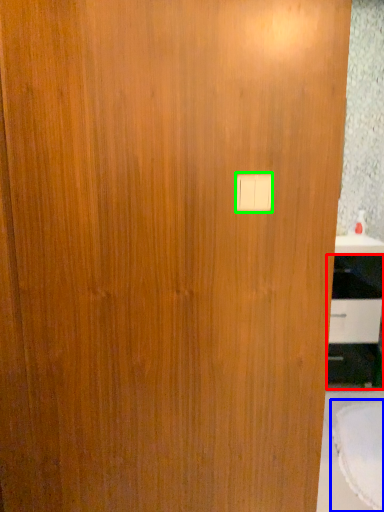
Question: Which object is positioned closest to cabinetry (highlighted by a red box)? Select from round table (highlighted by a blue box) and light switch (highlighted by a green box).

Choices:
 (A) round table
 (B) light switch

Answer: (A)